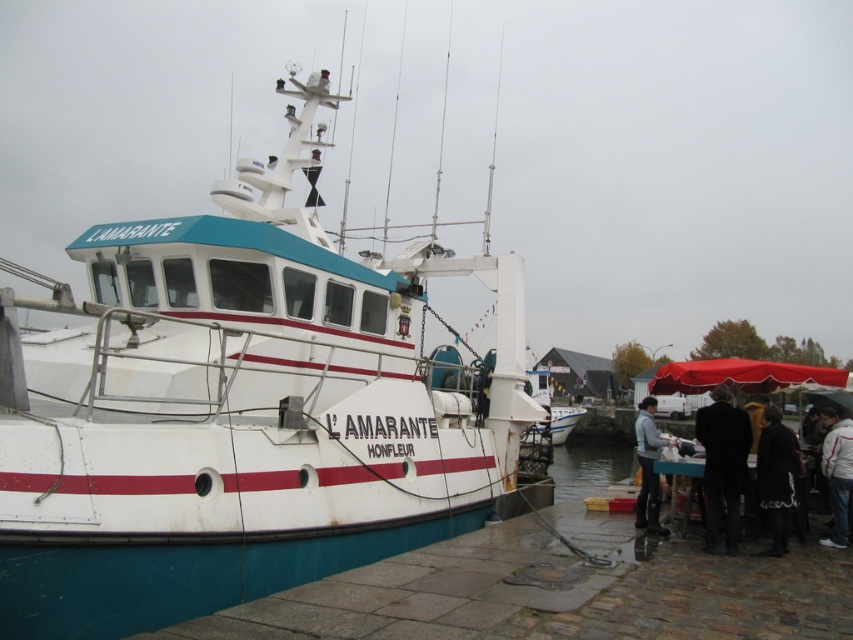
Is dark gray wool coat at lower right bigger than light gray fabric jacket at lower right?

Actually, dark gray wool coat at lower right might be smaller than light gray fabric jacket at lower right.

Can you confirm if dark gray wool coat at lower right is positioned to the left of light gray fabric jacket at lower right?

Yes, dark gray wool coat at lower right is to the left of light gray fabric jacket at lower right.

The image size is (853, 640). I want to click on dark gray wool coat at lower right, so click(x=776, y=477).

Between point (735, 452) and point (851, 428), which one is positioned behind?

Point (851, 428)

Which is above, black wool coat at lower right or white fabric jacket at lower right?

Positioned higher is black wool coat at lower right.

Find the location of a particular element. This screenshot has height=640, width=853. black wool coat at lower right is located at coordinates (722, 465).

The height and width of the screenshot is (640, 853). In order to click on black wool coat at lower right in this screenshot , I will do `click(722, 465)`.

Is white matte boat at center taller than dark gray wool coat at lower right?

Yes.

What do you see at coordinates (241, 410) in the screenshot? I see `white matte boat at center` at bounding box center [241, 410].

Does point (415, 436) come closer to viewer compared to point (758, 490)?

No, it is not.

Locate an element on the screen. The image size is (853, 640). white matte boat at center is located at coordinates (241, 410).